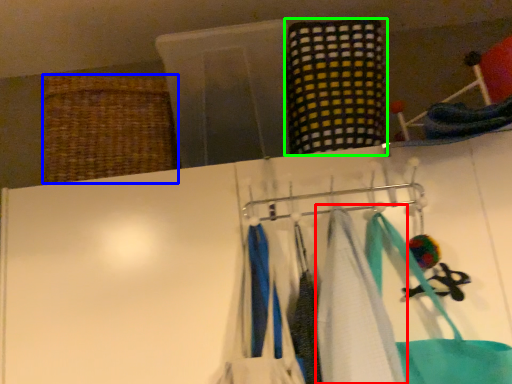
Question: Which is farther away from towel (highlighted by a red box)? basket (highlighted by a blue box) or clothing (highlighted by a green box)?

Choices:
 (A) basket
 (B) clothing

Answer: (A)